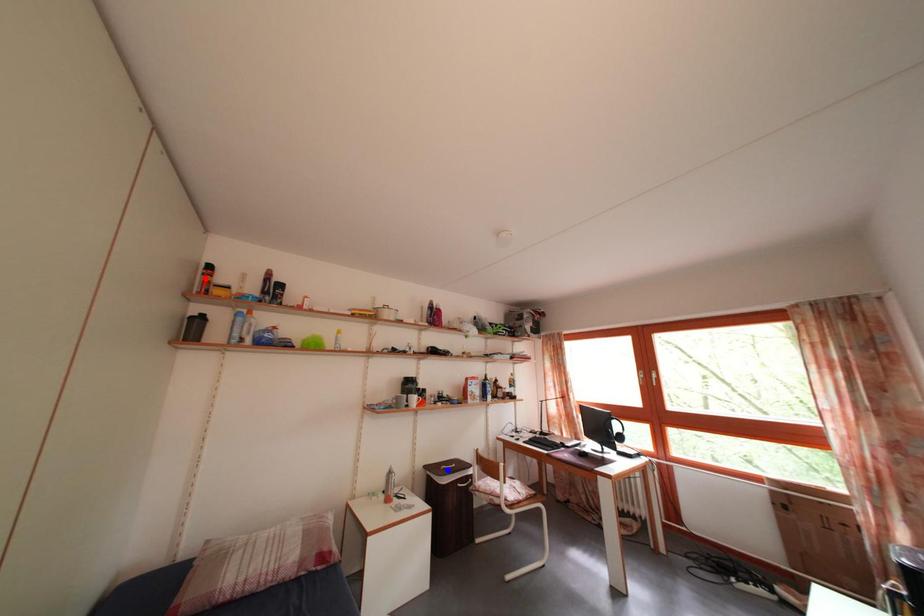
Question: In the image, two points are highlighted. Which point is nearer to the camera? Reply with the corresponding letter.

Choices:
 (A) blue point
 (B) red point

Answer: (B)